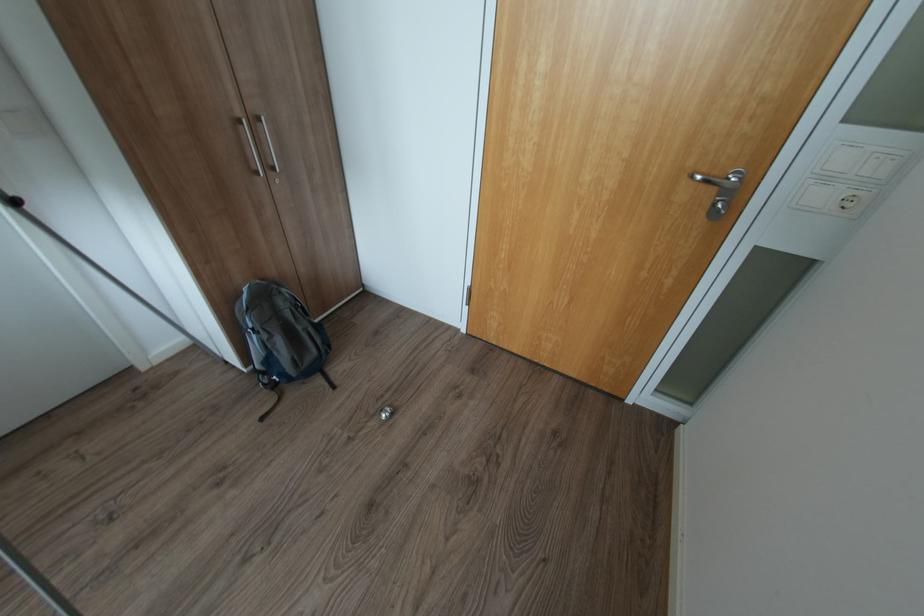
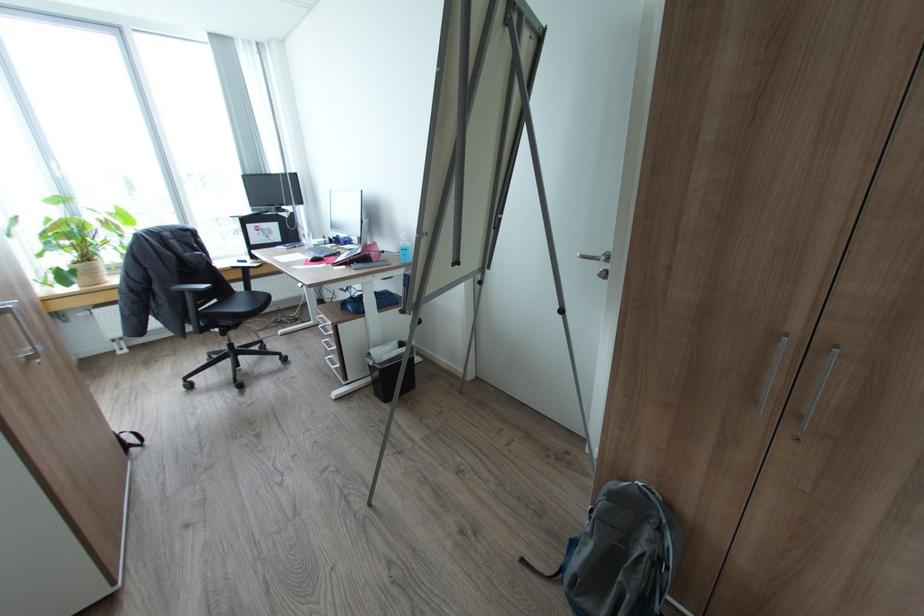
In the second image, find the point that corresponds to (268,418) in the first image.

(527, 560)